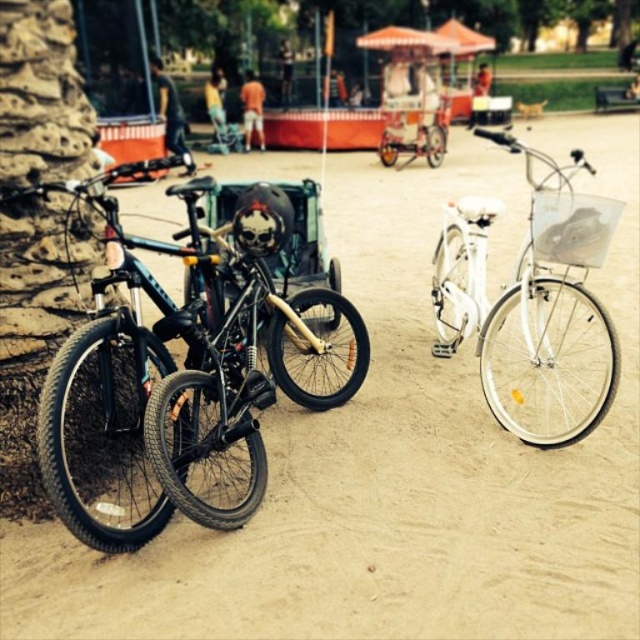
Does shiny black bicycle at left appear over white metallic bicycle at right?

A: No.

Where is `shiny black bicycle at left`? The height and width of the screenshot is (640, 640). shiny black bicycle at left is located at coordinates (188, 353).

At what (x,y) coordinates should I click in order to perform the action: click on shiny black bicycle at left. Please return your answer as a coordinate pair (x, y). The image size is (640, 640). Looking at the image, I should click on (188, 353).